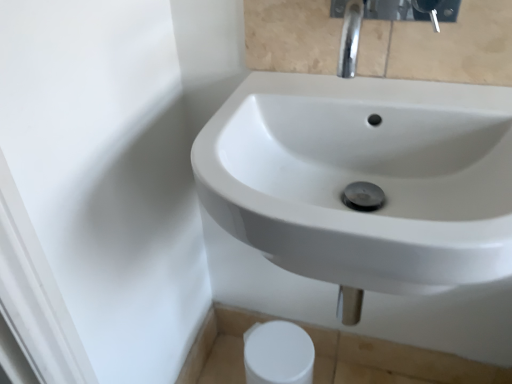
Locate an element on the screen. This screenshot has height=384, width=512. free spot above white matte toilet paper at lower center (from a real-world perspective) is located at coordinates (276, 349).